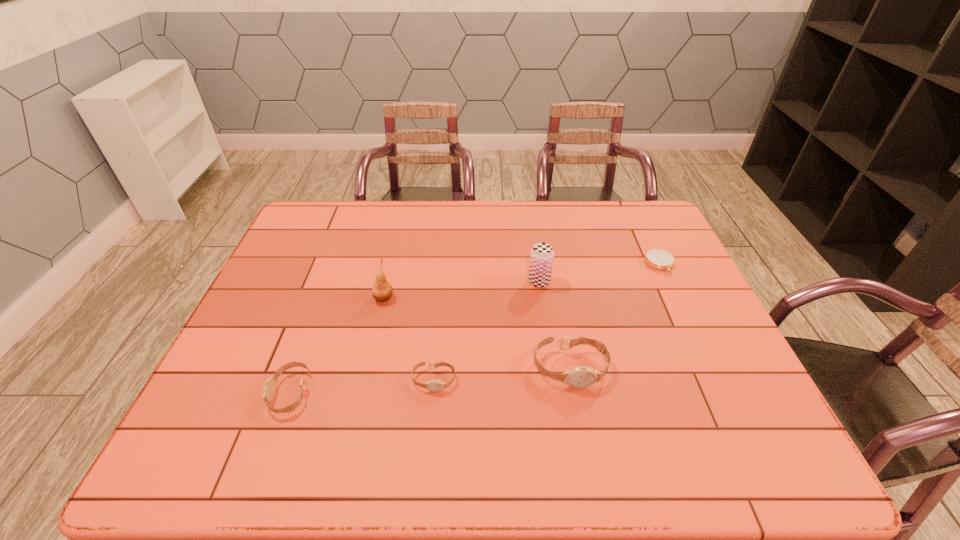
With all watchs evenly spaced, where should an extra watch be placed on the right to continue the pattern? Please point out a vacant space. Please provide its 2D coordinates. Your answer should be formatted as a tuple, i.e. [(x, y)], where the tuple contains the x and y coordinates of a point satisfying the conditions above.

[(700, 356)]